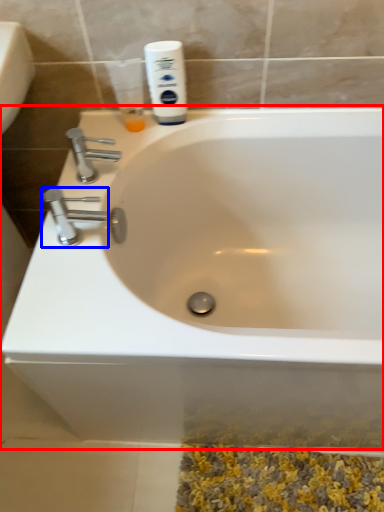
Question: Which of the following is the closest to the observer, bathtub (highlighted by a red box) or tap (highlighted by a blue box)?

Choices:
 (A) bathtub
 (B) tap

Answer: (A)